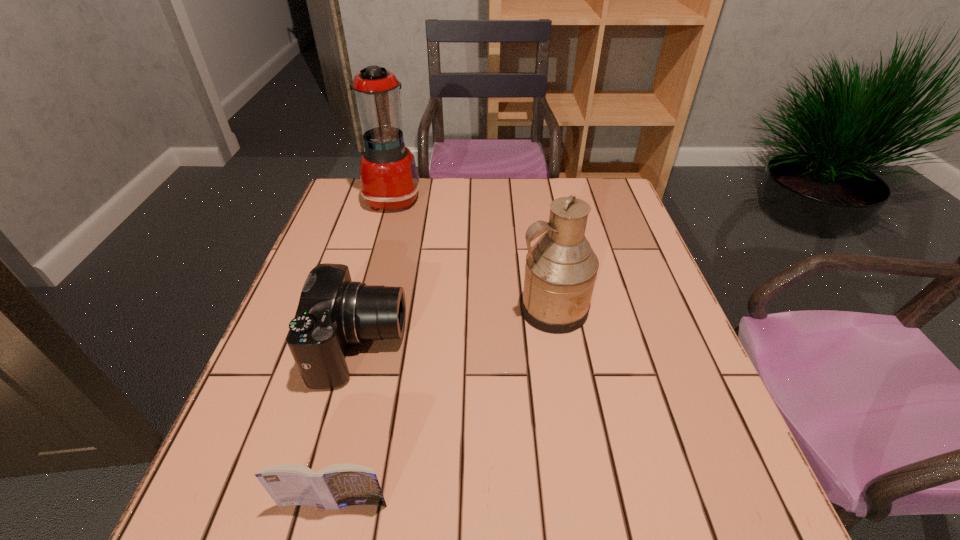
Where is `object that is at the far edge`? object that is at the far edge is located at coordinates (389, 180).

Image resolution: width=960 pixels, height=540 pixels. I want to click on object situated at the near edge, so click(x=335, y=486).

Find the location of a particular element. food processor located in the left edge section of the desktop is located at coordinates (389, 180).

This screenshot has height=540, width=960. I want to click on camera present at the left edge, so click(x=334, y=312).

The image size is (960, 540). In order to click on book positioned at the left edge in this screenshot , I will do `click(335, 486)`.

At what (x,y) coordinates should I click in order to perform the action: click on object located in the far left corner section of the desktop. Please return your answer as a coordinate pair (x, y). This screenshot has width=960, height=540. Looking at the image, I should click on (389, 180).

Where is `object that is at the near left corner`? The width and height of the screenshot is (960, 540). object that is at the near left corner is located at coordinates (335, 486).

In the image, there is a desktop. Where is `vacant space at the far edge`? Image resolution: width=960 pixels, height=540 pixels. vacant space at the far edge is located at coordinates (460, 212).

Where is `free space at the near edge of the desktop`? free space at the near edge of the desktop is located at coordinates [x=488, y=529].

Locate an element on the screen. This screenshot has height=540, width=960. vacant region at the left edge of the desktop is located at coordinates (245, 447).